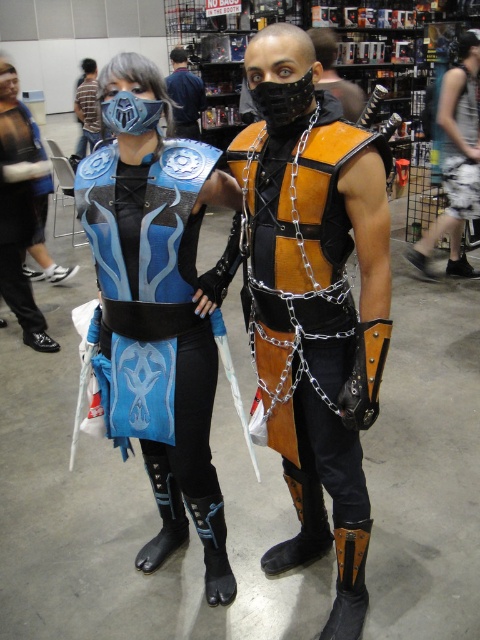
Is point (15, 202) farther from viewer compared to point (173, 61)?

No, (15, 202) is closer to viewer.

Is point (6, 81) closer to camera compared to point (180, 60)?

That is True.

Between point (28, 321) and point (196, 86), which one is positioned in front?

Positioned in front is point (28, 321).

Locate an element on the screen. Image resolution: width=480 pixels, height=640 pixels. matte black armor at left is located at coordinates (19, 212).

Who is more distant from viewer, (128, 330) or (34, 336)?

The point (34, 336) is behind.

Can you confirm if matte blue fabric vest at center is taller than matte black armor at left?

Incorrect, matte blue fabric vest at center's height is not larger of matte black armor at left's.

You are a GUI agent. You are given a task and a screenshot of the screen. Output one action in this format:
    pyautogui.click(x=<x>, y=<y>)
    Task: Click on the matte blue fabric vest at center
    The width and height of the screenshot is (480, 640).
    Given the screenshot: What is the action you would take?
    pyautogui.click(x=157, y=305)

Does point (194, 138) lie in front of point (87, 109)?

Yes.

Describe the element at coordinates (184, 96) in the screenshot. I see `matte black mask at upper center` at that location.

I want to click on matte black mask at upper center, so click(x=184, y=96).